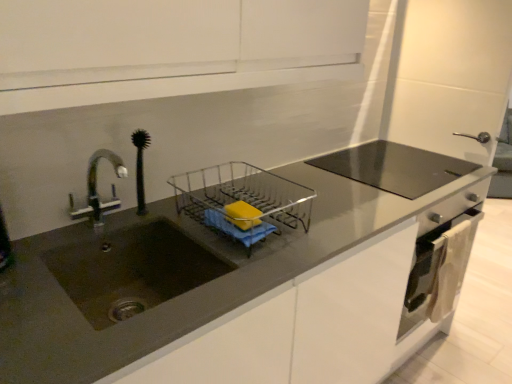
Find the location of a particular element. This screenshot has height=384, width=512. free space behind yellow matte soap at center is located at coordinates (261, 208).